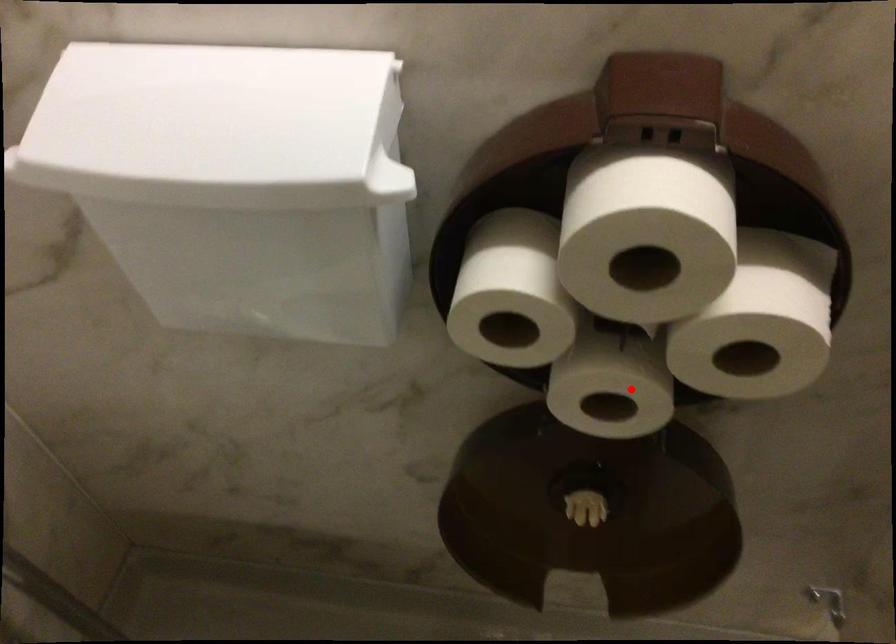
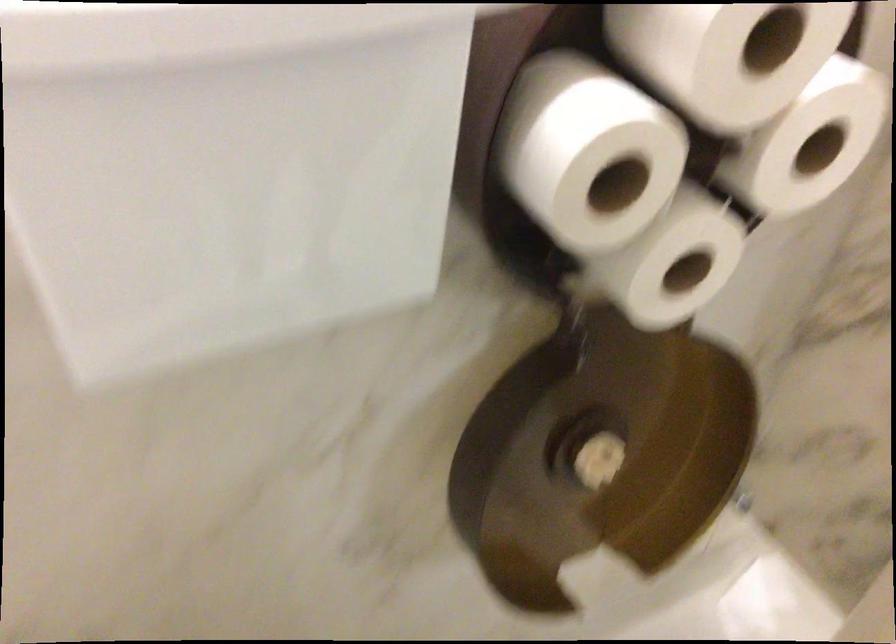
In the second image, find the point that corresponds to the highlighted location in the first image.

(672, 261)